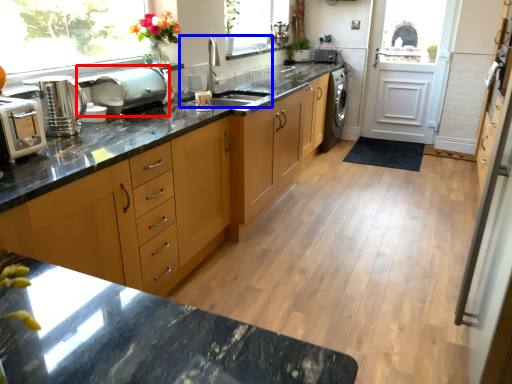
Question: Which object is further to the camera taking this photo, appliance (highlighted by a red box) or sink (highlighted by a blue box)?

Choices:
 (A) appliance
 (B) sink

Answer: (B)